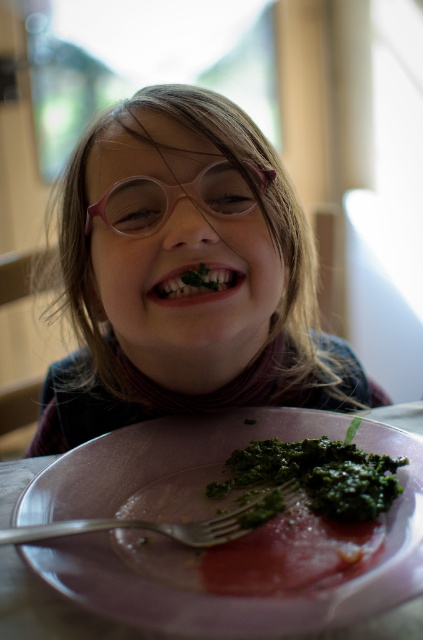
Between point (173, 272) and point (178, 609), which one is positioned in front?

Point (178, 609) is in front.

Which is below, pink plastic glasses at upper center or green leafymaterial/textureplatter at lower center?

green leafymaterial/textureplatter at lower center

Is point (242, 384) closer to camera compared to point (63, 465)?

No.

The image size is (423, 640). Find the location of `pink plastic glasses at upper center`. pink plastic glasses at upper center is located at coordinates (186, 275).

Is pink plastic glasses at upper center to the right of green leafymaterial/texturebroccoli at lower center from the viewer's perspective?

Incorrect, pink plastic glasses at upper center is not on the right side of green leafymaterial/texturebroccoli at lower center.

Who is more distant from viewer, (139, 365) or (231, 468)?

Point (139, 365)

This screenshot has height=640, width=423. Describe the element at coordinates (186, 275) in the screenshot. I see `pink plastic glasses at upper center` at that location.

This screenshot has width=423, height=640. What are the coordinates of `pink plastic glasses at upper center` in the screenshot? It's located at (186, 275).

Who is more distant from viewer, (335, 490) or (131, 230)?

Positioned behind is point (131, 230).

From the picture: Is green leafymaterial/texturebroccoli at lower center above pink plastic glasses at center?

No, green leafymaterial/texturebroccoli at lower center is not above pink plastic glasses at center.

Image resolution: width=423 pixels, height=640 pixels. What do you see at coordinates (318, 476) in the screenshot? I see `green leafymaterial/texturebroccoli at lower center` at bounding box center [318, 476].

You are a GUI agent. You are given a task and a screenshot of the screen. Output one action in this format:
    pyautogui.click(x=<x>, y=<y>)
    Task: Click on the green leafymaterial/texturebroccoli at lower center
    This screenshot has height=640, width=423.
    Given the screenshot: What is the action you would take?
    pyautogui.click(x=318, y=476)